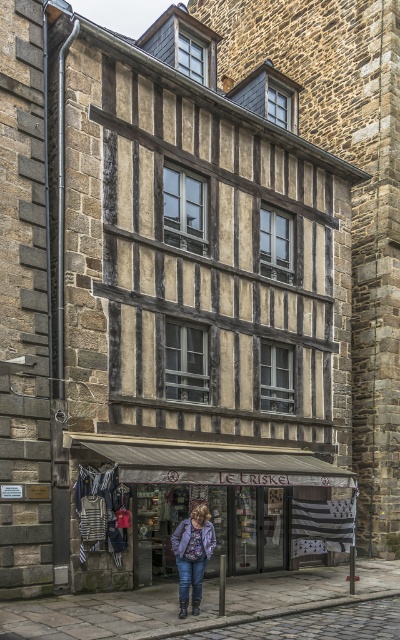
Who is more forward, (328, 465) or (208, 548)?

Point (208, 548) is in front.

Can you confirm if white canvas awning at lower center is bigger than denim jacket at center?

Incorrect, white canvas awning at lower center is not larger than denim jacket at center.

Is point (100, 444) closer to viewer compared to point (192, 522)?

No, (100, 444) is behind (192, 522).

The height and width of the screenshot is (640, 400). Identify the location of white canvas awning at lower center. (212, 461).

Does matte gray awning at center lie behind white canvas awning at lower center?

Yes, matte gray awning at center is behind white canvas awning at lower center.

Can you confirm if matte gray awning at center is positioned to the left of white canvas awning at lower center?

Indeed, matte gray awning at center is positioned on the left side of white canvas awning at lower center.

Between point (160, 532) and point (249, 474), which one is positioned behind?

The point (160, 532) is more distant.

In order to click on matte gray awning at center in this screenshot , I will do `click(212, 500)`.

Is matte gray awning at center shorter than denim jacket at center?

Indeed, matte gray awning at center has a lesser height compared to denim jacket at center.

Does matte gray awning at center appear on the right side of denim jacket at center?

In fact, matte gray awning at center is to the left of denim jacket at center.

Which is in front, point (142, 442) or point (208, 548)?

Positioned in front is point (208, 548).

Find the location of a particular element. The height and width of the screenshot is (640, 400). matte gray awning at center is located at coordinates coord(212,500).